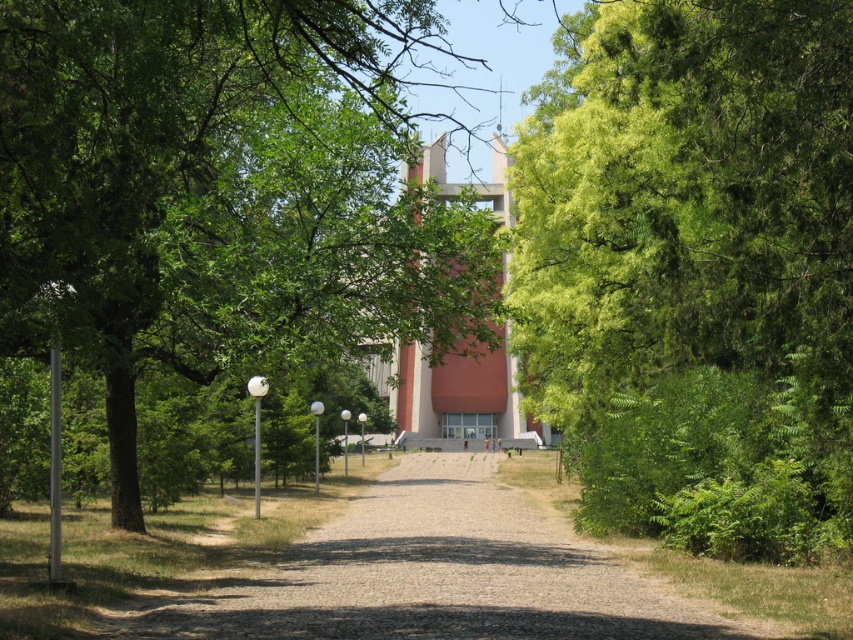
You are standing on the paved pathway in the park and see two points marked on the ground. The first point is at coordinate point (796, 93) and the second is at point (44, 147). Which point is closer to you as you stand on the path?

Point (796, 93) is closer to you because it is further to the viewer than point (44, 147).

You are a visitor trying to reach the entrance of the modern building. You see the green leafy tree at center and the gravel driveway at center. Which object is closer to you as you approach the building?

The green leafy tree at center is closer to you than the gravel driveway at center because it is in front of it.

You are a visitor trying to reach the entrance of the modern building in the background. You are currently standing at the start of the pathway. To your left, you see the green leafy tree at center and to your right, the gravel driveway at center. Which direction should you turn to head towards the building?

You should turn to your right towards the gravel driveway at center because the green leafy tree at center is to the left of it, and the pathway leading to the building is likely aligned with the driveway.